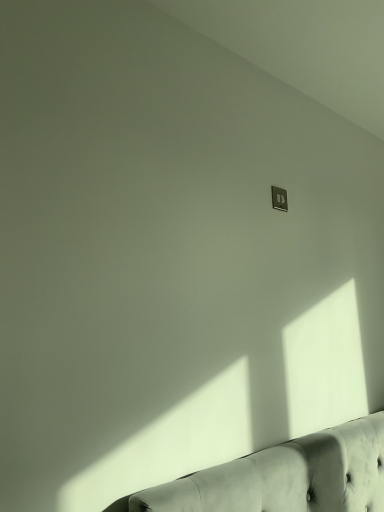
Image resolution: width=384 pixels, height=512 pixels. I want to click on tufted leather couch at lower right, so click(x=284, y=477).

This screenshot has width=384, height=512. Describe the element at coordinates (284, 477) in the screenshot. I see `tufted leather couch at lower right` at that location.

Describe the element at coordinates (279, 198) in the screenshot. I see `metallic silver outlet at upper right` at that location.

The width and height of the screenshot is (384, 512). Identify the location of metallic silver outlet at upper right. (279, 198).

Identify the location of tufted leather couch at lower right. (284, 477).

Which object is positioned more to the left, tufted leather couch at lower right or metallic silver outlet at upper right?

From the viewer's perspective, metallic silver outlet at upper right appears more on the left side.

Does tufted leather couch at lower right come behind metallic silver outlet at upper right?

No, tufted leather couch at lower right is in front of metallic silver outlet at upper right.

Considering the points (296, 484) and (285, 197), which point is in front, point (296, 484) or point (285, 197)?

The point (296, 484) is closer.

In the scene shown: From the image's perspective, relative to metallic silver outlet at upper right, is tufted leather couch at lower right above or below?

Clearly, from the image's perspective, tufted leather couch at lower right is below metallic silver outlet at upper right.

From a real-world perspective, relative to metallic silver outlet at upper right, is tufted leather couch at lower right vertically above or below?

Clearly, from a real-world perspective, tufted leather couch at lower right is below metallic silver outlet at upper right.

Looking at their sizes, would you say tufted leather couch at lower right is wider or thinner than metallic silver outlet at upper right?

Considering their sizes, tufted leather couch at lower right looks broader than metallic silver outlet at upper right.

Does tufted leather couch at lower right have a greater height compared to metallic silver outlet at upper right?

Incorrect, the height of tufted leather couch at lower right is not larger of that of metallic silver outlet at upper right.

Looking at this image, can you confirm if tufted leather couch at lower right is smaller than metallic silver outlet at upper right?

Incorrect, tufted leather couch at lower right is not smaller in size than metallic silver outlet at upper right.

Do you think tufted leather couch at lower right is within metallic silver outlet at upper right, or outside of it?

tufted leather couch at lower right is outside metallic silver outlet at upper right.

Is tufted leather couch at lower right touching metallic silver outlet at upper right?

tufted leather couch at lower right and metallic silver outlet at upper right are not in contact.

Is tufted leather couch at lower right facing towards metallic silver outlet at upper right?

No, tufted leather couch at lower right is not aimed at metallic silver outlet at upper right.

Can you tell me how much tufted leather couch at lower right and metallic silver outlet at upper right differ in facing direction?

The facing directions of tufted leather couch at lower right and metallic silver outlet at upper right are 0.884 degrees apart.

The height and width of the screenshot is (512, 384). Identify the location of studio couch on the right of metallic silver outlet at upper right. (284, 477).

Can you confirm if metallic silver outlet at upper right is positioned to the left of tufted leather couch at lower right?

Answer: Indeed, metallic silver outlet at upper right is positioned on the left side of tufted leather couch at lower right.

Which is behind, metallic silver outlet at upper right or tufted leather couch at lower right?

metallic silver outlet at upper right is behind.

Is point (285, 203) closer to camera compared to point (355, 463)?

No, it is behind (355, 463).

From the image's perspective, is metallic silver outlet at upper right positioned above or below tufted leather couch at lower right?

metallic silver outlet at upper right is situated higher than tufted leather couch at lower right in the image.

From a real-world perspective, relative to tufted leather couch at lower right, is metallic silver outlet at upper right vertically above or below?

From a real-world perspective, metallic silver outlet at upper right is physically above tufted leather couch at lower right.

Is metallic silver outlet at upper right thinner than tufted leather couch at lower right?

Yes, metallic silver outlet at upper right is thinner than tufted leather couch at lower right.

Between metallic silver outlet at upper right and tufted leather couch at lower right, which one has more height?

Standing taller between the two is metallic silver outlet at upper right.

Based on the photo, which of these two, metallic silver outlet at upper right or tufted leather couch at lower right, is bigger?

tufted leather couch at lower right.

Could tufted leather couch at lower right be considered to be inside metallic silver outlet at upper right?

No, metallic silver outlet at upper right does not contain tufted leather couch at lower right.

Is metallic silver outlet at upper right far away from tufted leather couch at lower right?

No, metallic silver outlet at upper right is in close proximity to tufted leather couch at lower right.

Is metallic silver outlet at upper right looking in the opposite direction of tufted leather couch at lower right?

That's not correct — metallic silver outlet at upper right is not looking away from tufted leather couch at lower right.

What's the angular difference between metallic silver outlet at upper right and tufted leather couch at lower right's facing directions?

There is a 0.884-degree angle between the facing directions of metallic silver outlet at upper right and tufted leather couch at lower right.

Measure the distance from metallic silver outlet at upper right to tufted leather couch at lower right.

metallic silver outlet at upper right and tufted leather couch at lower right are 34.94 inches apart from each other.

Locate an element on the screen. The image size is (384, 512). studio couch that is in front of the metallic silver outlet at upper right is located at coordinates (284, 477).

Identify the location of studio couch on the right side of metallic silver outlet at upper right. This screenshot has width=384, height=512. (284, 477).

Find the location of `electric outlet behind the tufted leather couch at lower right`. electric outlet behind the tufted leather couch at lower right is located at coordinates (279, 198).